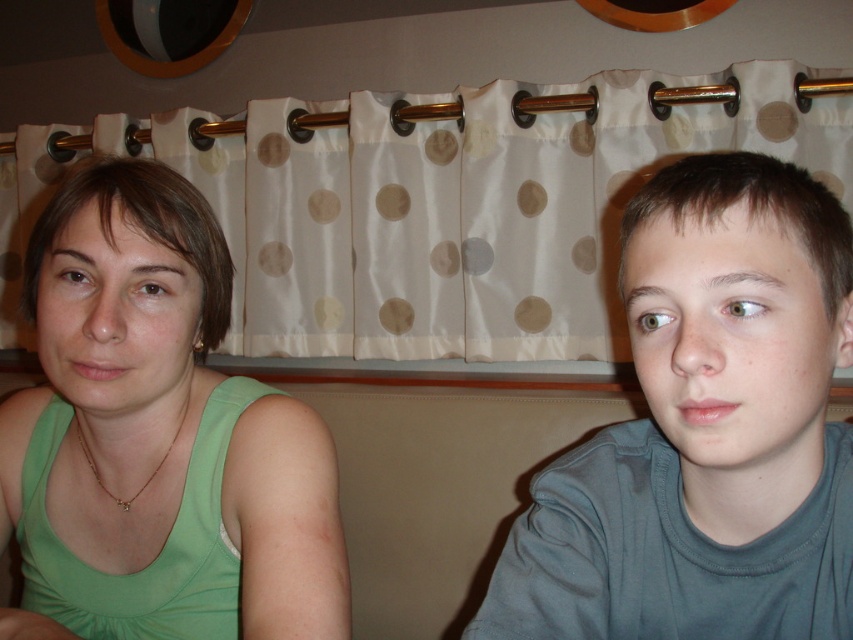
Can you confirm if gray cotton shirt at right is thinner than green fabric tank top at left?

Yes, gray cotton shirt at right is thinner than green fabric tank top at left.

Between point (598, 557) and point (218, 307), which one is positioned behind?

Positioned behind is point (218, 307).

Identify the location of gray cotton shirt at right. The image size is (853, 640). (705, 429).

Who is higher up, white polka dot fabric at upper center or green fabric tank top at left?

white polka dot fabric at upper center is higher up.

Does white polka dot fabric at upper center have a greater height compared to green fabric tank top at left?

Correct, white polka dot fabric at upper center is much taller as green fabric tank top at left.

Locate an element on the screen. The width and height of the screenshot is (853, 640). white polka dot fabric at upper center is located at coordinates click(451, 202).

This screenshot has height=640, width=853. What are the coordinates of `white polka dot fabric at upper center` in the screenshot? It's located at (451, 202).

Which of these two, white polka dot fabric at upper center or gray cotton shirt at right, stands taller?

white polka dot fabric at upper center

Between white polka dot fabric at upper center and gray cotton shirt at right, which one is positioned higher?

white polka dot fabric at upper center is higher up.

Who is more forward, (335, 216) or (682, 596)?

Positioned in front is point (682, 596).

Identify the location of white polka dot fabric at upper center. [x=451, y=202].